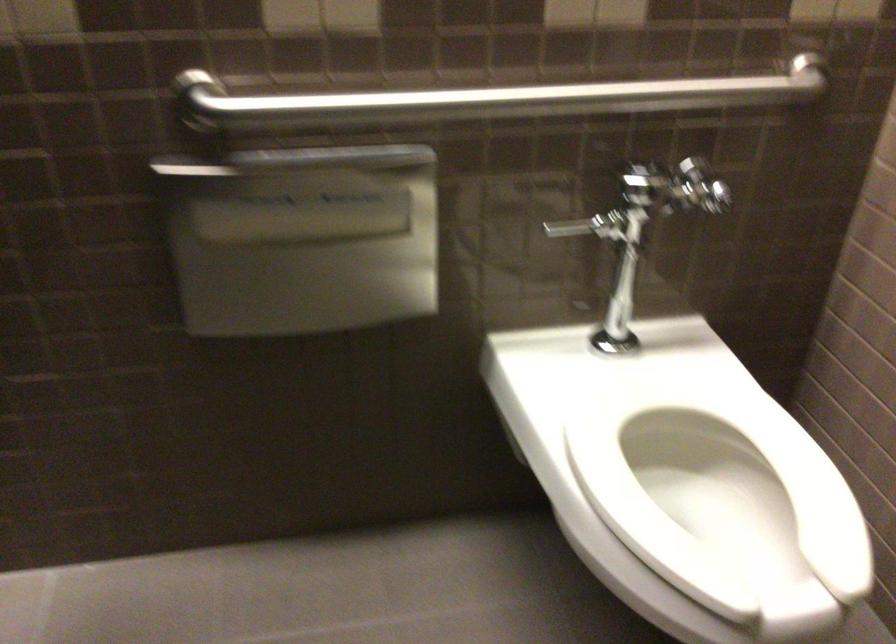
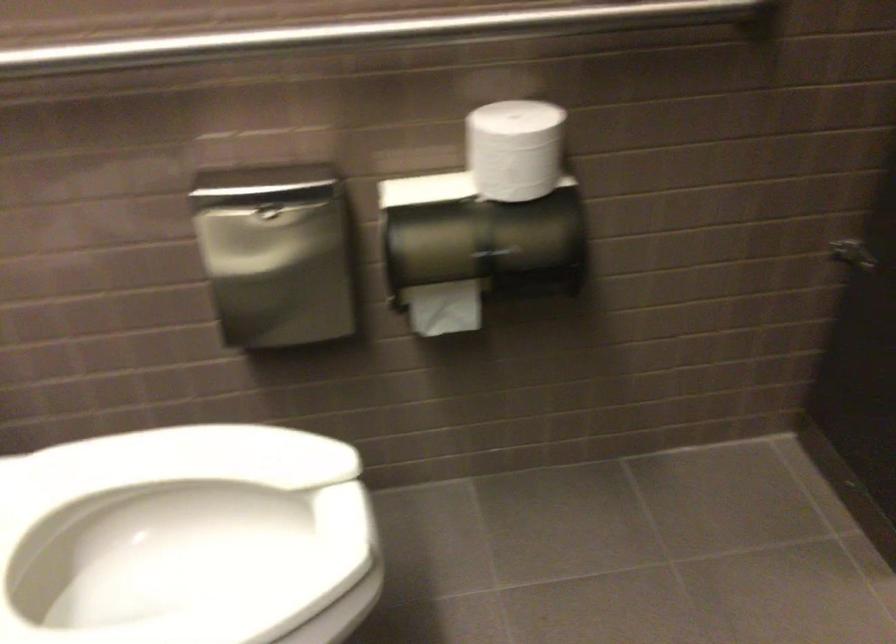
Based on the continuous images, in which direction is the camera rotating?

The camera rotated toward right-down.